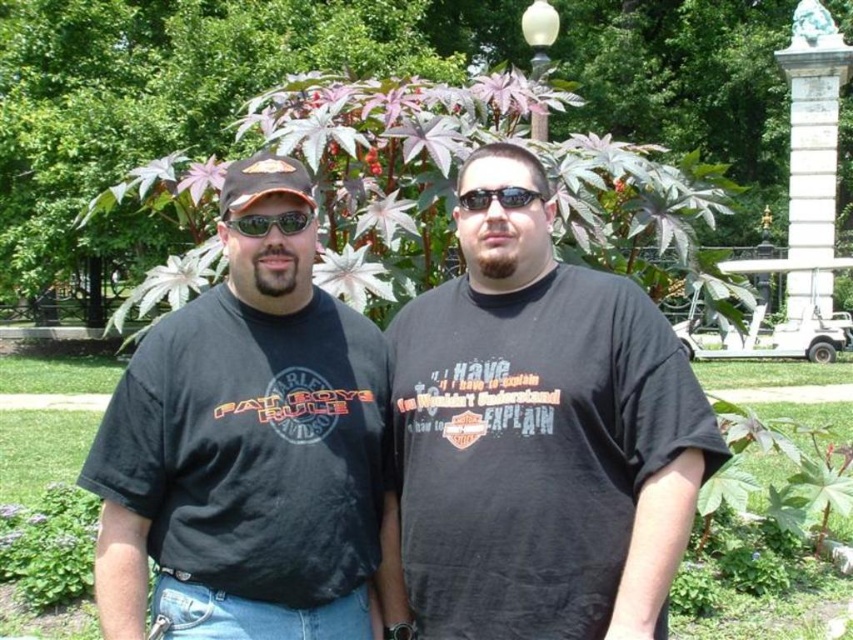
Can you confirm if black cotton t-shirt at center is bigger than purple leafy plant at center?

Incorrect, black cotton t-shirt at center is not larger than purple leafy plant at center.

Between point (660, 337) and point (73, 198), which one is positioned in front?

Point (660, 337) is more forward.

Where is `black cotton t-shirt at center`? The height and width of the screenshot is (640, 853). black cotton t-shirt at center is located at coordinates (540, 435).

Find the location of a particular element. The width and height of the screenshot is (853, 640). black cotton t-shirt at center is located at coordinates (540, 435).

From the picture: Does purple leafy plant at center appear under black plastic sunglasses at center?

Actually, purple leafy plant at center is above black plastic sunglasses at center.

Which is behind, point (212, 141) or point (312, 211)?

The point (212, 141) is behind.

Where is `purple leafy plant at center`? purple leafy plant at center is located at coordinates (180, 97).

Between point (502, 332) and point (260, 410), which one is positioned behind?

The point (502, 332) is more distant.

Does black cotton t-shirt at center appear under black cotton t-shirt at left?

No, black cotton t-shirt at center is not below black cotton t-shirt at left.

Which is behind, point (473, 394) or point (276, 612)?

Positioned behind is point (473, 394).

Find the location of a particular element. This screenshot has width=853, height=640. black cotton t-shirt at center is located at coordinates (540, 435).